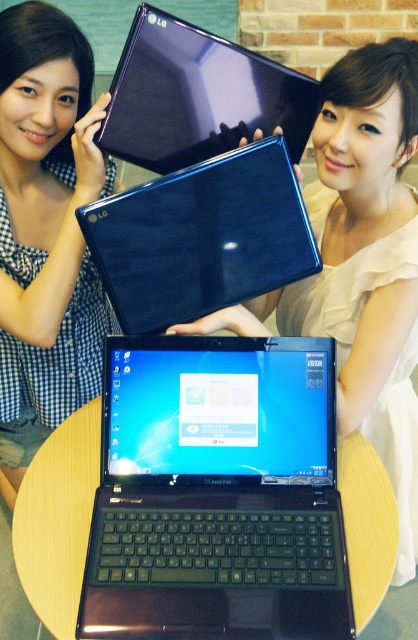
Which of these two, metallic blue laptop at center or white checkered dress at left, stands shorter?

metallic blue laptop at center

Does point (116, 586) come farther from viewer compared to point (5, 384)?

No, (116, 586) is closer to viewer.

Find the location of `metallic blue laptop at center`. metallic blue laptop at center is located at coordinates (216, 493).

Does white checkered dress at left lie behind glossy plastic laptop at upper center?

Yes, white checkered dress at left is further from the viewer.

Who is more distant from viewer, (50, 422) or (120, 145)?

Point (50, 422)

Where is `white checkered dress at left`? This screenshot has height=640, width=418. white checkered dress at left is located at coordinates (46, 228).

Does matte blue laptop at center appear on the right side of glossy plastic laptop at upper center?

Yes, matte blue laptop at center is to the right of glossy plastic laptop at upper center.

Is matte blue laptop at center thinner than glossy plastic laptop at upper center?

No.

Describe the element at coordinates (361, 264) in the screenshot. I see `matte blue laptop at center` at that location.

Find the location of a particular element. This screenshot has height=640, width=418. matte blue laptop at center is located at coordinates (361, 264).